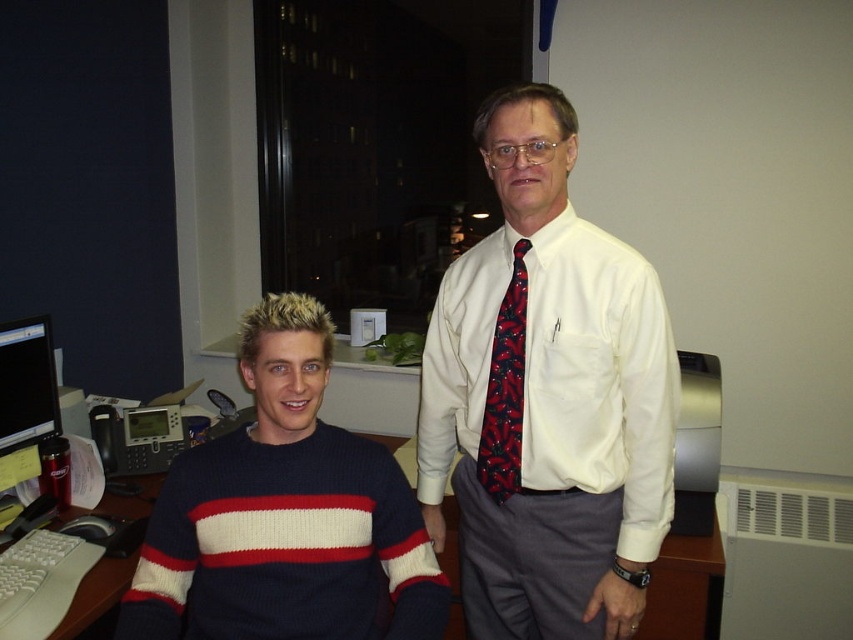
Who is shorter, knit sweater at left or white cotton dress shirt at center?

Standing shorter between the two is knit sweater at left.

Is knit sweater at left closer to the viewer compared to white cotton dress shirt at center?

Yes, knit sweater at left is closer to the viewer.

In order to click on knit sweater at left in this screenshot , I will do `click(285, 515)`.

Is point (149, 572) positioned before point (495, 448)?

Yes, point (149, 572) is closer to viewer.

Is point (302, 552) closer to viewer compared to point (492, 486)?

Yes, it is in front of point (492, 486).

Locate an element on the screen. The width and height of the screenshot is (853, 640). knit sweater at left is located at coordinates (285, 515).

Does white cotton dress shirt at center appear over dark red textured tie at center?

No, white cotton dress shirt at center is not above dark red textured tie at center.

What do you see at coordinates (560, 372) in the screenshot? The height and width of the screenshot is (640, 853). I see `white cotton dress shirt at center` at bounding box center [560, 372].

Locate an element on the screen. The image size is (853, 640). white cotton dress shirt at center is located at coordinates (560, 372).